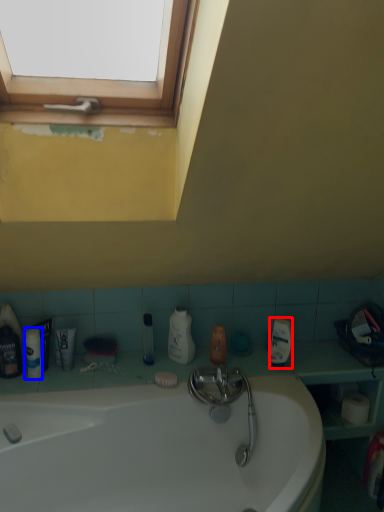
Question: Among these objects, which one is farthest to the camera, cleaning product (highlighted by a red box) or toiletry (highlighted by a blue box)?

Choices:
 (A) cleaning product
 (B) toiletry

Answer: (A)